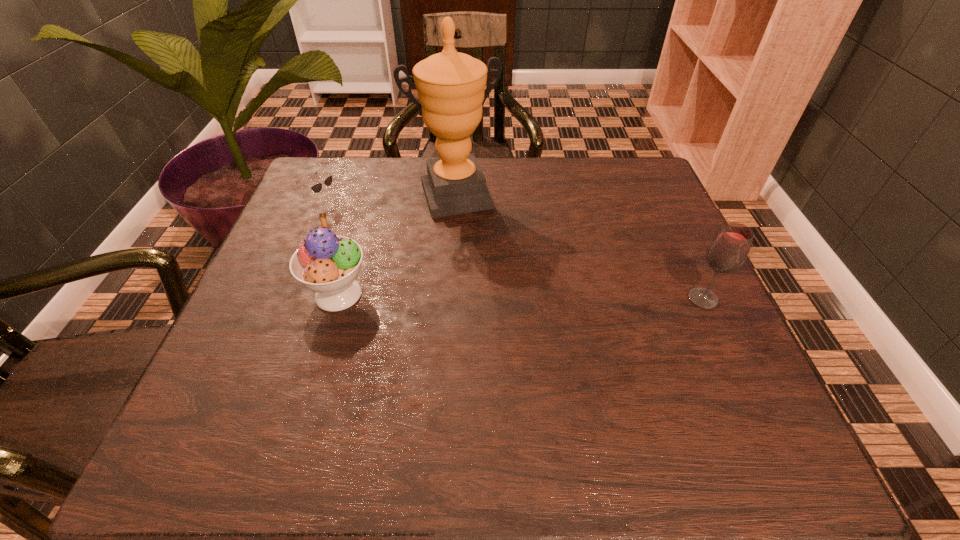
Find the location of a particular element. This screenshot has width=960, height=540. blank region between the tallest object and the rightmost object is located at coordinates (579, 247).

I want to click on unoccupied area between the icecream and the glass drink container, so click(x=520, y=296).

At what (x,y) coordinates should I click in order to perform the action: click on vacant point located between the icecream and the tallest object. Please return your answer as a coordinate pair (x, y). This screenshot has height=540, width=960. Looking at the image, I should click on (396, 245).

Find the location of a particular element. The height and width of the screenshot is (540, 960). unoccupied position between the second object from right to left and the shortest object is located at coordinates (389, 200).

At what (x,y) coordinates should I click in order to perform the action: click on empty space between the tallest object and the shortest object. Please return your answer as a coordinate pair (x, y). Looking at the image, I should click on (389, 200).

Where is `unoccupied area between the tallest object and the icecream`? The width and height of the screenshot is (960, 540). unoccupied area between the tallest object and the icecream is located at coordinates (396, 245).

Identify which object is the second nearest to the glass drink container. Please provide its 2D coordinates. Your answer should be formatted as a tuple, i.e. [(x, y)], where the tuple contains the x and y coordinates of a point satisfying the conditions above.

[(328, 264)]

Select which object is the third closest to the rightmost object. Please provide its 2D coordinates. Your answer should be formatted as a tuple, i.e. [(x, y)], where the tuple contains the x and y coordinates of a point satisfying the conditions above.

[(316, 188)]

You are a GUI agent. You are given a task and a screenshot of the screen. Output one action in this format:
    pyautogui.click(x=<x>, y=<y>)
    Task: Click on the blank area in the image that satisfies the following two spatial constraints: 1. on the back side of the icecream; 2. on the right side of the tallest object
    The image size is (960, 540).
    Given the screenshot: What is the action you would take?
    pyautogui.click(x=368, y=196)

In order to click on free space that satisfies the following two spatial constraints: 1. on the front side of the glass drink container; 2. on the right side of the sunglasses in this screenshot , I will do `click(285, 299)`.